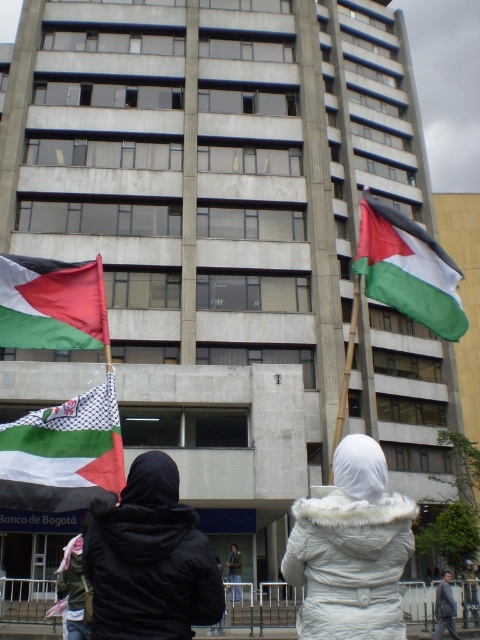
Does white and black checkered flag at lower left come behind green and white fabric flag at lower left?

That is False.

Between point (20, 472) and point (81, 292), which one is positioned in front?

Point (20, 472) is in front.

Describe the element at coordinates (63, 452) in the screenshot. I see `white and black checkered flag at lower left` at that location.

This screenshot has width=480, height=640. Find the location of `white and black checkered flag at lower left`. white and black checkered flag at lower left is located at coordinates (63, 452).

What do you see at coordinates (350, 548) in the screenshot? I see `white fur coat at center` at bounding box center [350, 548].

Which is more to the left, white fur coat at center or white fur coat at lower right?

From the viewer's perspective, white fur coat at center appears more on the left side.

Does point (312, 540) lie in front of point (448, 586)?

That is True.

The height and width of the screenshot is (640, 480). I want to click on white fur coat at center, so click(350, 548).

Which is more to the right, black matte jacket at lower left or green and white fabric flag at lower left?

black matte jacket at lower left is more to the right.

Can you confirm if black matte jacket at lower left is taller than green and white fabric flag at lower left?

Yes, black matte jacket at lower left is taller than green and white fabric flag at lower left.

What do you see at coordinates (149, 560) in the screenshot? Image resolution: width=480 pixels, height=640 pixels. I see `black matte jacket at lower left` at bounding box center [149, 560].

Locate an element on the screen. Image resolution: width=480 pixels, height=640 pixels. black matte jacket at lower left is located at coordinates (149, 560).